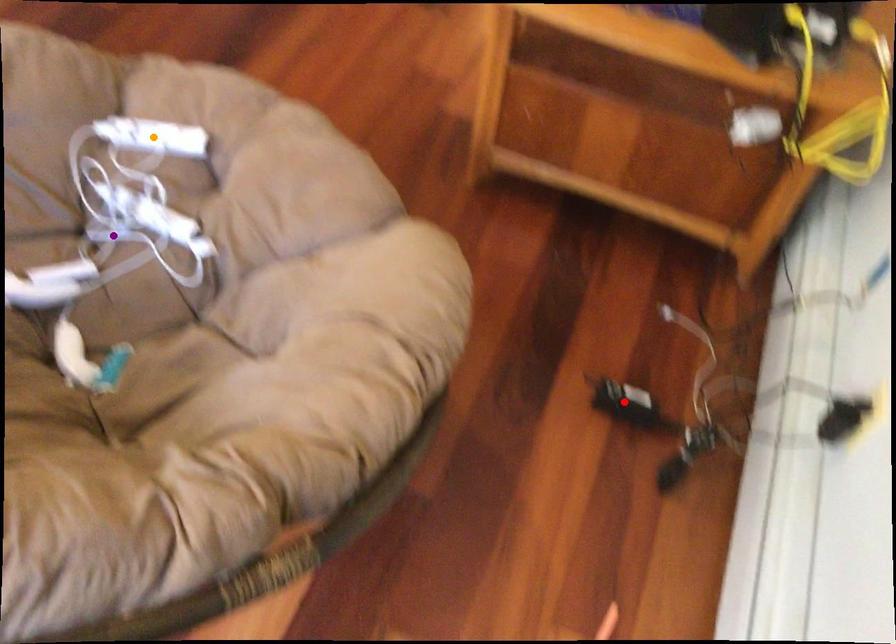
Order these from nearest to farthest:
purple point, orange point, red point

1. red point
2. orange point
3. purple point